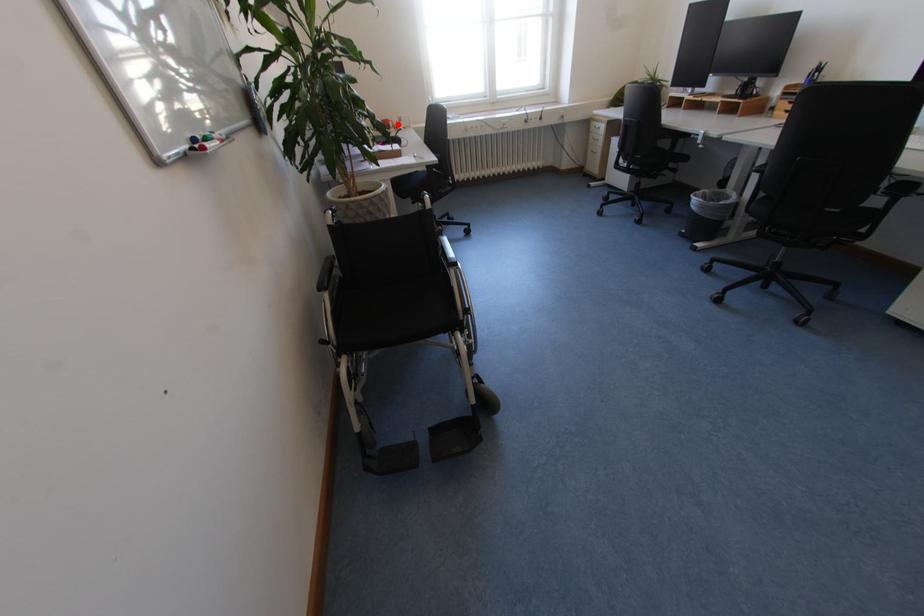
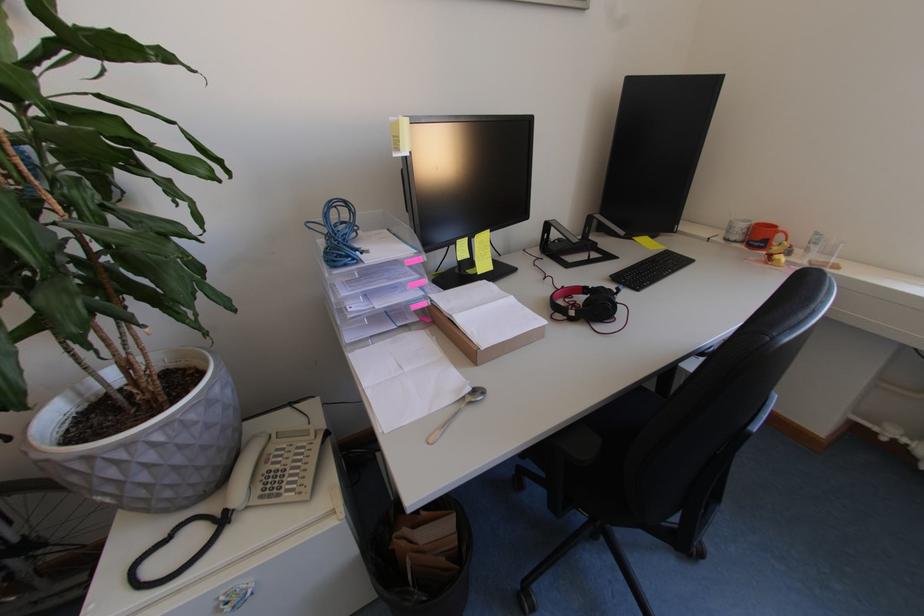
Find the pixel in the second image that matches the highlighted location in the first image.

(786, 238)